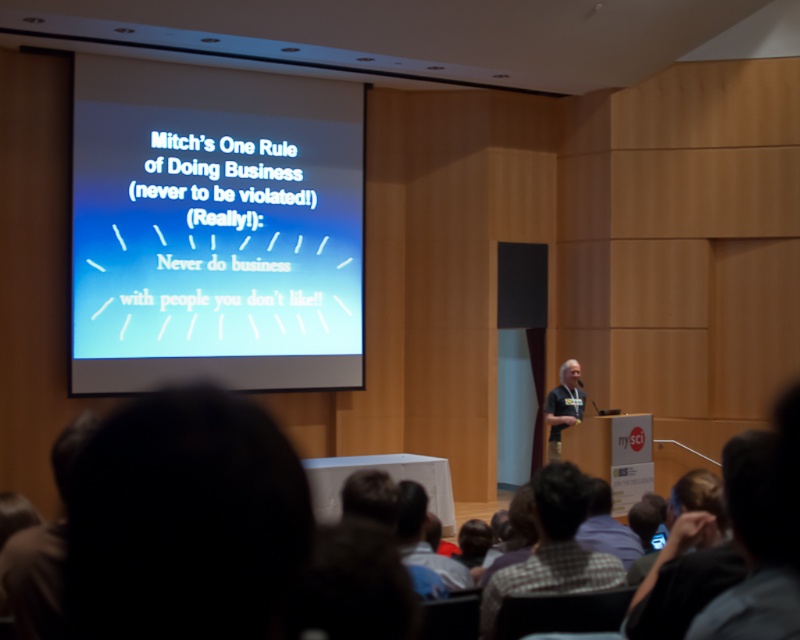
Question: Which point is closer to the camera taking this photo?

Choices:
 (A) (578, 413)
 (B) (208, 328)

Answer: (A)

Question: Where is white matte projector screen at upper center located in relation to checkered shirt at lower center in the image?

Choices:
 (A) right
 (B) left

Answer: (B)

Question: Which of the following is the closest to the observer?

Choices:
 (A) pos(226,115)
 (B) pos(496,573)

Answer: (B)

Question: Is white matte projector screen at upper center bigger than checkered shirt at lower center?

Choices:
 (A) no
 (B) yes

Answer: (B)

Question: Is checkered shirt at lower center to the right of dark gray shirt at center from the viewer's perspective?

Choices:
 (A) yes
 (B) no

Answer: (B)

Question: Among these objects, which one is farthest from the camera?

Choices:
 (A) dark gray shirt at center
 (B) checkered shirt at lower center
 (C) white matte projector screen at upper center

Answer: (C)